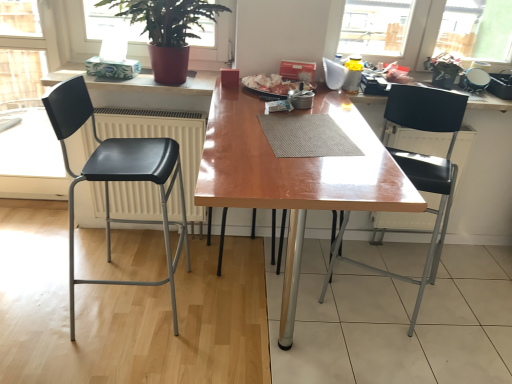
The image size is (512, 384). I want to click on free space in front of black matte chair at left, marked as the 2th chair in a right-to-left arrangement, so click(x=103, y=361).